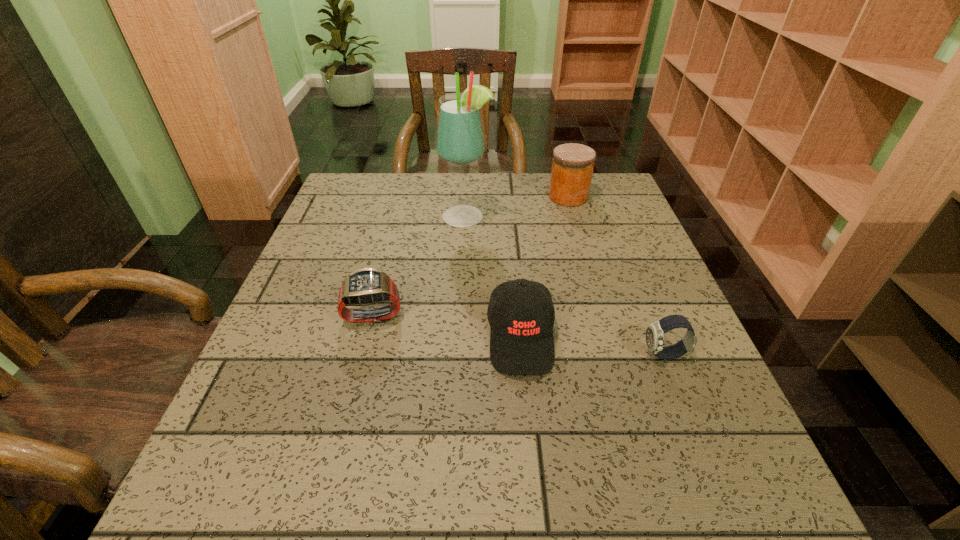
Locate an element on the screen. This screenshot has width=960, height=540. free space at the near edge of the desktop is located at coordinates (590, 509).

Where is `vacant space at the left edge`? The width and height of the screenshot is (960, 540). vacant space at the left edge is located at coordinates (373, 221).

Locate an element on the screen. vacant space at the right edge of the desktop is located at coordinates click(x=604, y=229).

Locate an element on the screen. Image resolution: width=960 pixels, height=540 pixels. vacant space at the far left corner is located at coordinates (376, 187).

Locate an element on the screen. vacant area at the near right corner of the desktop is located at coordinates (676, 469).

The height and width of the screenshot is (540, 960). Find the location of `free space between the alcohol and the baseball cap`. free space between the alcohol and the baseball cap is located at coordinates (493, 277).

You are a GUI agent. You are given a task and a screenshot of the screen. Output one action in this format:
    pyautogui.click(x=<x>, y=<y>)
    Task: Click on the vacant area between the baseball cap and the right watch
    
    Given the screenshot: What is the action you would take?
    pos(593,346)

I want to click on empty space that is in between the baseball cap and the jar, so click(x=544, y=267).

Identify the location of free space between the baseball cap and the jar. This screenshot has height=540, width=960. (544, 267).

Find the location of a particular element. The image size is (960, 540). vacant space that's between the leftmost object and the baseball cap is located at coordinates (447, 326).